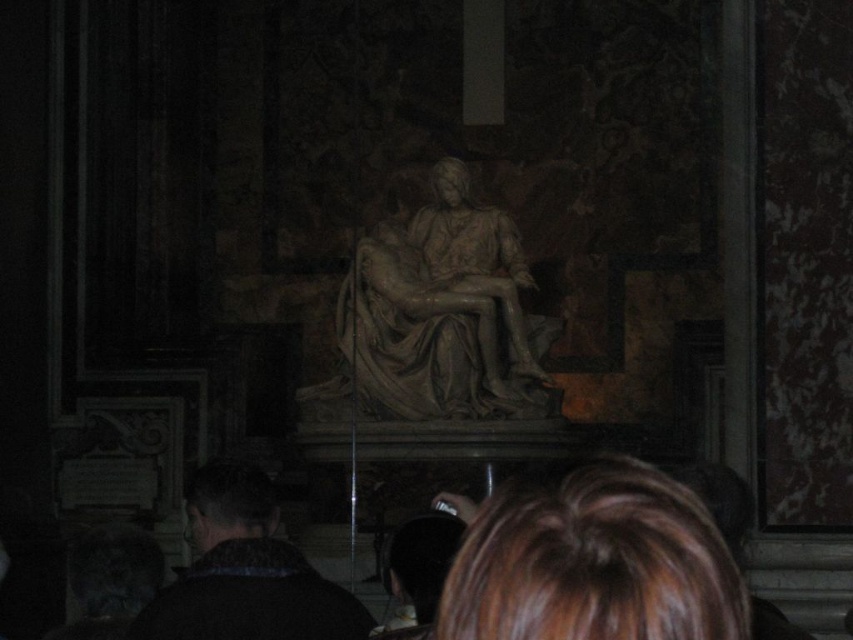
Question: Which point is farther from the camera taking this photo?

Choices:
 (A) (410, 365)
 (B) (196, 525)
 (C) (619, 458)

Answer: (C)

Question: Which point appears closest to the camera in this image?

Choices:
 (A) (697, 563)
 (B) (224, 563)

Answer: (A)

Question: Can you confirm if brown hair at lower center is smaller than gray stone sculpture at center?

Choices:
 (A) no
 (B) yes

Answer: (B)

Question: Which point is closer to the camera?

Choices:
 (A) black woolen sweater at lower left
 (B) brown hair at lower center
 (C) gray stone sculpture at center

Answer: (B)

Question: Can you confirm if brown hair at lower center is thinner than gray stone sculpture at center?

Choices:
 (A) yes
 (B) no

Answer: (A)

Question: Does brown hair at lower center have a greater width compared to black woolen sweater at lower left?

Choices:
 (A) no
 (B) yes

Answer: (B)